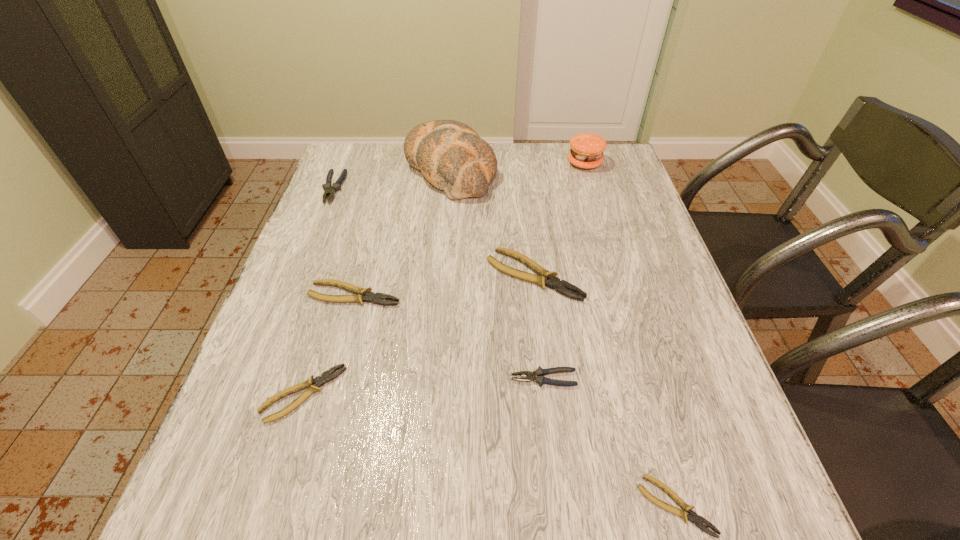
Identify which yellow pliers is the second nearest to the second biggest yellow pliers. Please provide its 2D coordinates. Your answer should be formatted as a tuple, i.e. [(x, y)], where the tuple contains the x and y coordinates of a point satisfying the conditions above.

[(544, 278)]

Identify which yellow pliers is the second closest to the third smallest yellow pliers. Please provide its 2D coordinates. Your answer should be formatted as a tuple, i.e. [(x, y)], where the tuple contains the x and y coordinates of a point satisfying the conditions above.

[(544, 278)]